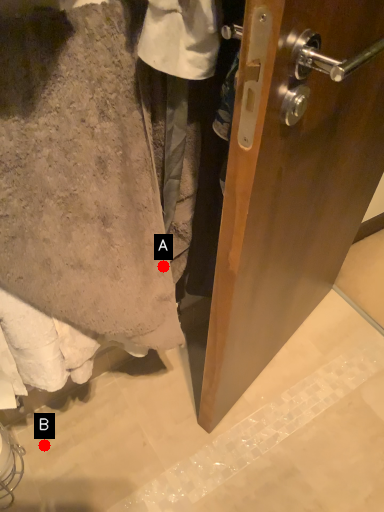
Question: Two points are circled on the image, labeled by A and B beside each circle. Which point is farther to the camera?

Choices:
 (A) A is further
 (B) B is further

Answer: (B)